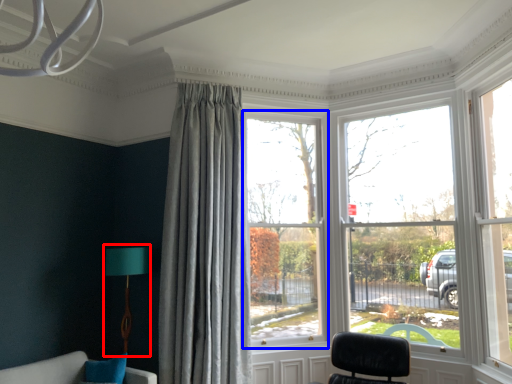
Question: Which of the following is the farthest to the observer, table lamp (highlighted by a red box) or window (highlighted by a blue box)?

Choices:
 (A) table lamp
 (B) window

Answer: (B)